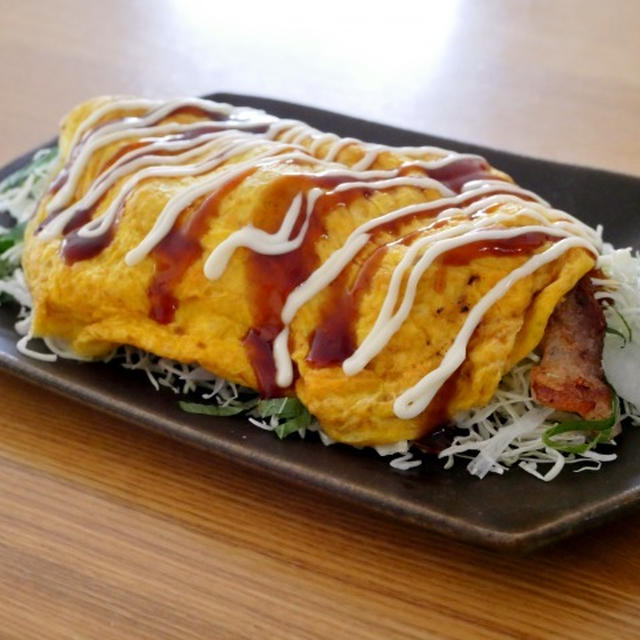
Where is `plate`? The height and width of the screenshot is (640, 640). plate is located at coordinates (498, 518).